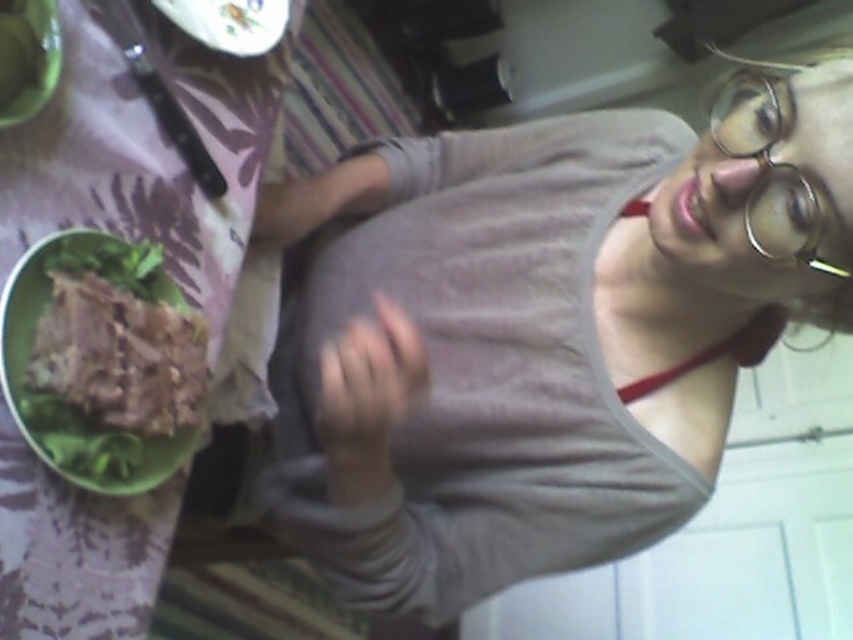
You are a fashion designer observing the image and need to decide which item is taller between the gray cotton tank top at center and the green matte bowl at upper left. Which one is taller?

The gray cotton tank top at center is taller than the green matte bowl at upper left according to the description.

You are a chef preparing a dish and need to place a garnish on the nearest bowl. Which bowl should you choose between the green plastic bowl at upper left and the green matte bowl at left?

The green plastic bowl at upper left is closer, so you should choose the green plastic bowl at upper left to place the garnish.

You are a delivery robot that needs to place a small package between the gray cotton tank top at center and the green matte bowl at upper left. The package is 10 inches long. Can you fit it there?

The distance between the gray cotton tank top at center and the green matte bowl at upper left is 18.80 inches. Since the package is only 10 inches long, there is enough space to fit it between them.